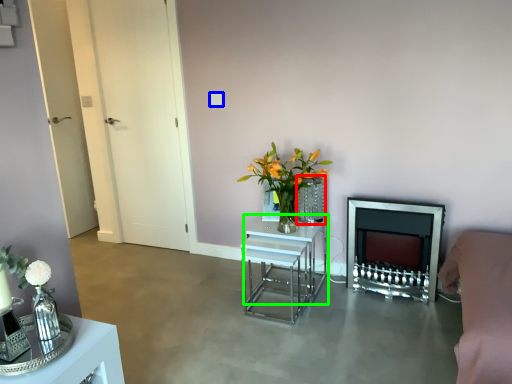
Question: Which is farther away from vase (highlighted by a red box)? square (highlighted by a blue box) or table (highlighted by a green box)?

Choices:
 (A) square
 (B) table

Answer: (A)